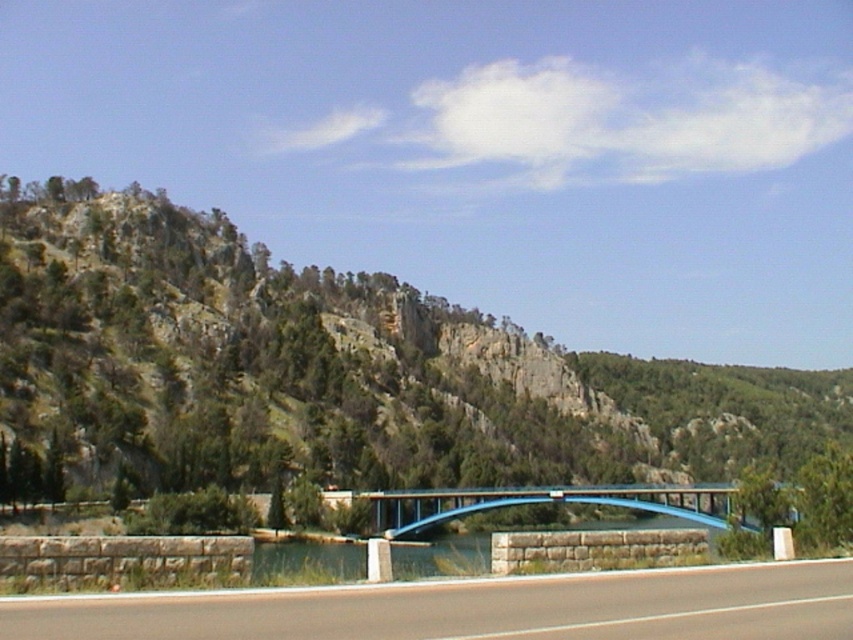
Question: From the image, what is the correct spatial relationship of smooth asphalt highway at center in relation to blue metallic bridge at center?

Choices:
 (A) below
 (B) above

Answer: (B)

Question: Is green rocky mountain at upper left to the left of smooth asphalt highway at center from the viewer's perspective?

Choices:
 (A) yes
 (B) no

Answer: (B)

Question: Which point is closer to the camera?

Choices:
 (A) blue metallic bridge at center
 (B) green rocky mountain at upper left
 (C) smooth asphalt highway at center

Answer: (C)

Question: Which of the following is the farthest from the observer?

Choices:
 (A) (177, 333)
 (B) (741, 582)

Answer: (A)

Question: Which of the following is the farthest from the observer?

Choices:
 (A) smooth asphalt highway at center
 (B) green rocky mountain at upper left

Answer: (B)

Question: Does smooth asphalt highway at center have a greater width compared to blue metallic bridge at center?

Choices:
 (A) yes
 (B) no

Answer: (B)